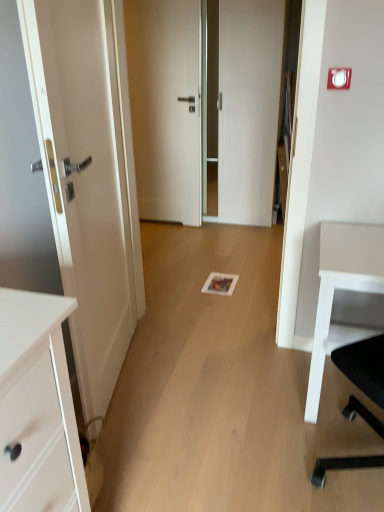
Question: Is white matte door at center, the third door when ordered from front to back, taller than white matte desk at right?

Choices:
 (A) yes
 (B) no

Answer: (A)

Question: From a real-world perspective, is white matte door at center, the first door in the back-to-front sequence, under white matte desk at right?

Choices:
 (A) yes
 (B) no

Answer: (B)

Question: Is white matte door at center, the third door when ordered from front to back, far away from white matte desk at right?

Choices:
 (A) yes
 (B) no

Answer: (A)

Question: Does white matte door at center, the third door when ordered from front to back, come in front of white matte desk at right?

Choices:
 (A) no
 (B) yes

Answer: (A)

Question: Is white matte door at center, the first door in the back-to-front sequence, wider than white matte desk at right?

Choices:
 (A) no
 (B) yes

Answer: (A)

Question: In the image, is white matte door at center, the first door in the back-to-front sequence, positioned in front of or behind white glossy door at center, placed as the 2th door when sorted from front to back?

Choices:
 (A) behind
 (B) front

Answer: (A)

Question: From a real-world perspective, is white matte door at center, the third door when ordered from front to back, above or below white glossy door at center, placed as the 2th door when sorted from front to back?

Choices:
 (A) above
 (B) below

Answer: (B)

Question: Is white matte door at center, the first door in the back-to-front sequence, to the left or to the right of white glossy door at center, marked as the second door in a back-to-front arrangement, in the image?

Choices:
 (A) left
 (B) right

Answer: (A)

Question: Is point (193, 89) closer or farther from the camera than point (273, 84)?

Choices:
 (A) closer
 (B) farther

Answer: (B)

Question: From a real-world perspective, is white glossy door at center, marked as the second door in a back-to-front arrangement, above or below white matte door at center, the third door when ordered from front to back?

Choices:
 (A) below
 (B) above

Answer: (B)

Question: Is white glossy door at center, placed as the 2th door when sorted from front to back, inside the boundaries of white matte door at center, the first door in the back-to-front sequence, or outside?

Choices:
 (A) inside
 (B) outside

Answer: (B)

Question: In terms of size, does white glossy door at center, placed as the 2th door when sorted from front to back, appear bigger or smaller than white matte door at center, the first door in the back-to-front sequence?

Choices:
 (A) small
 (B) big

Answer: (B)

Question: Looking at their shapes, would you say white glossy door at center, marked as the second door in a back-to-front arrangement, is wider or thinner than white matte door at center, the first door in the back-to-front sequence?

Choices:
 (A) thin
 (B) wide

Answer: (B)

Question: Is point (226, 31) positioned closer to the camera than point (129, 283)?

Choices:
 (A) closer
 (B) farther

Answer: (B)

Question: In terms of size, does white glossy door at center, placed as the 2th door when sorted from front to back, appear bigger or smaller than white glossy door at left, positioned as the 1th door in front-to-back order?

Choices:
 (A) small
 (B) big

Answer: (B)